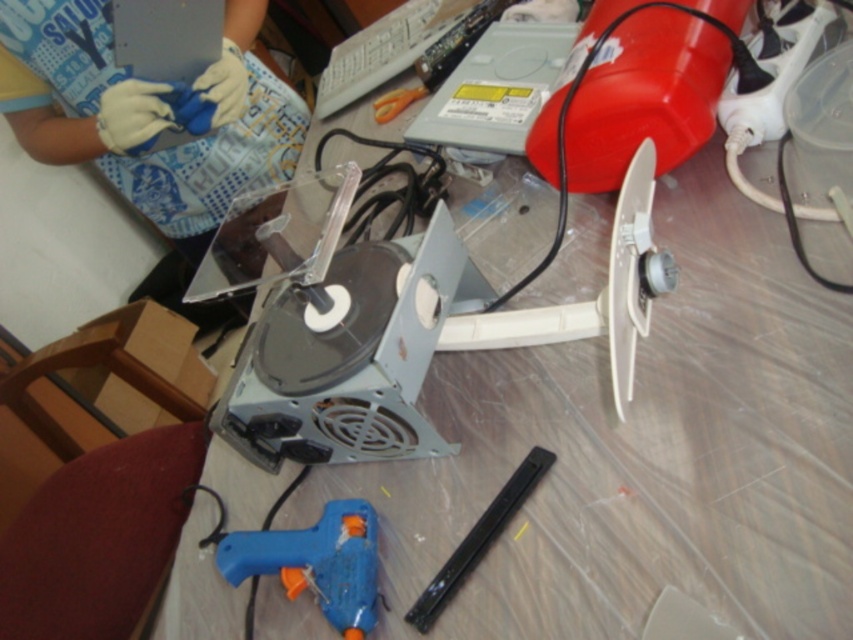
Question: Which point is closer to the camera?

Choices:
 (A) (560, 339)
 (B) (68, 140)
 (C) (537, 468)

Answer: (C)

Question: Does white gloves at upper left appear under black plastic tool at lower center?

Choices:
 (A) yes
 (B) no

Answer: (B)

Question: Which of the following is the farthest from the observer?

Choices:
 (A) white gloves at upper left
 (B) white plastic fan at center
 (C) blue plastic glue gun at lower center

Answer: (A)

Question: Considering the relative positions of white gloves at upper left and white plastic fan at center in the image provided, where is white gloves at upper left located with respect to white plastic fan at center?

Choices:
 (A) left
 (B) right

Answer: (A)

Question: Can you confirm if white gloves at upper left is positioned to the left of white plastic fan at center?

Choices:
 (A) no
 (B) yes

Answer: (B)

Question: Which point is closer to the camera taking this photo?

Choices:
 (A) (352, 554)
 (B) (502, 502)

Answer: (B)